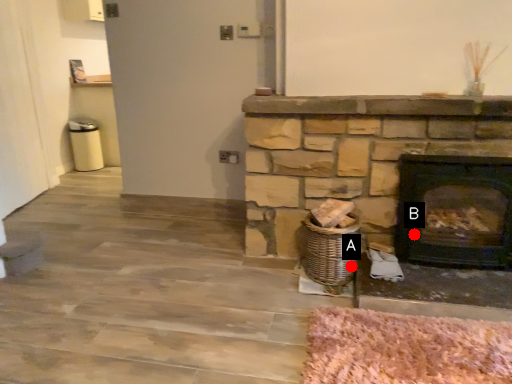
Question: Two points are circled on the image, labeled by A and B beside each circle. Which point appears closest to the camera in this image?

Choices:
 (A) A is closer
 (B) B is closer

Answer: (A)